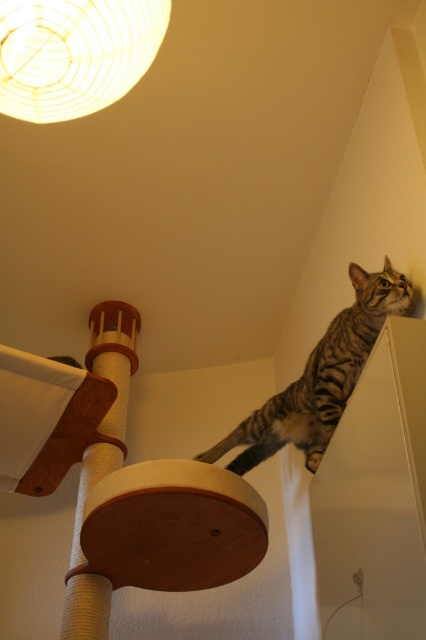
You are a cat owner trying to place a new toy on the cat tree. The cat tree has two points marked as point [351,376] and point [89,364]. If you want to place the toy where it will be more visible to the cat, which point should you choose?

Point [351,376] is closer to the viewer than point [89,364], so placing the toy there would make it more visible to the cat.